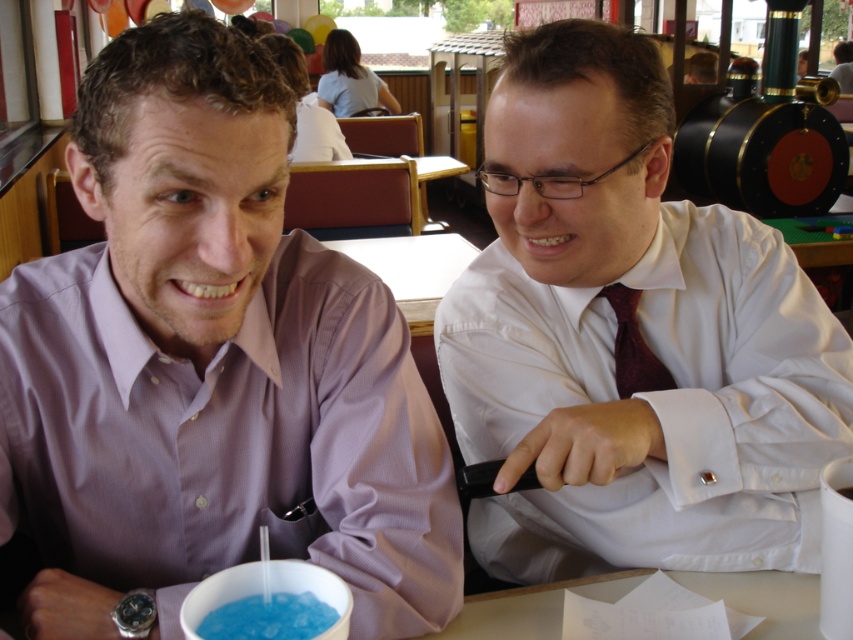
Does matte purple shirt at left have a lesser width compared to blue translucent liquid at lower center?

In fact, matte purple shirt at left might be wider than blue translucent liquid at lower center.

Does matte purple shirt at left appear on the right side of blue translucent liquid at lower center?

In fact, matte purple shirt at left is to the left of blue translucent liquid at lower center.

Between point (47, 387) and point (283, 616), which one is positioned in front?

Point (283, 616) is in front.

What are the coordinates of `matte purple shirt at left` in the screenshot? It's located at (210, 365).

Is white glossy shirt at upper right smaller than white paper at center?

No, white glossy shirt at upper right is not smaller than white paper at center.

Which is more to the left, white glossy shirt at upper right or white paper at center?

From the viewer's perspective, white glossy shirt at upper right appears more on the left side.

Find the location of a particular element. This screenshot has height=640, width=853. white glossy shirt at upper right is located at coordinates (641, 336).

Is white paper at center taller than maroon textured tie at right?

Incorrect, white paper at center's height is not larger of maroon textured tie at right's.

Is point (483, 600) less distant than point (630, 387)?

Yes, it is in front of point (630, 387).

Is point (767, 632) more distant than point (633, 369)?

That is False.

Where is `white paper at center`? This screenshot has height=640, width=853. white paper at center is located at coordinates (531, 608).